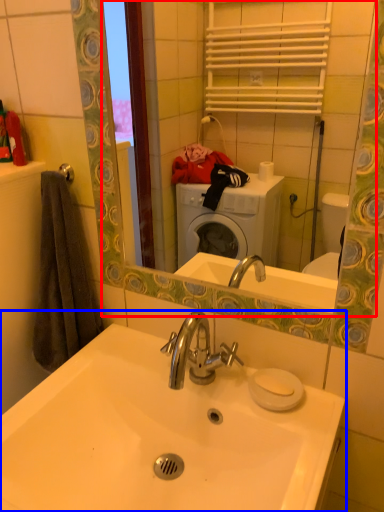
Question: Which object is closer to the camera taking this photo, mirror (highlighted by a red box) or sink (highlighted by a blue box)?

Choices:
 (A) mirror
 (B) sink

Answer: (B)